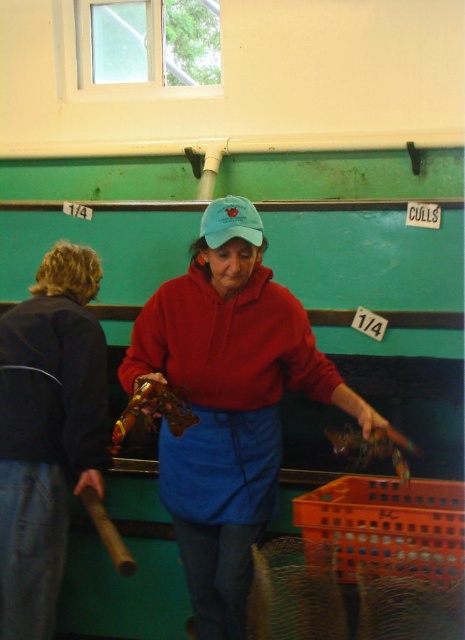
Can you confirm if matte red sweatshirt at center is wider than dark blue denim jacket at left?

Correct, the width of matte red sweatshirt at center exceeds that of dark blue denim jacket at left.

Is matte red sweatshirt at center further to camera compared to dark blue denim jacket at left?

That is True.

Does point (223, 380) come closer to viewer compared to point (60, 563)?

No, it is behind (60, 563).

Locate an element on the screen. matte red sweatshirt at center is located at coordinates click(227, 412).

Where is `matte red sweatshirt at center`? This screenshot has width=465, height=640. matte red sweatshirt at center is located at coordinates (227, 412).

Identify the location of matte red sweatshirt at center. This screenshot has height=640, width=465. (227, 412).

What are the coordinates of `matte red sweatshirt at center` in the screenshot? It's located at (227, 412).

Which is more to the left, dark blue denim jacket at left or blue cotton cap at center?

dark blue denim jacket at left

From the picture: Between dark blue denim jacket at left and blue cotton cap at center, which one appears on the right side from the viewer's perspective?

From the viewer's perspective, blue cotton cap at center appears more on the right side.

This screenshot has width=465, height=640. Identify the location of dark blue denim jacket at left. (47, 432).